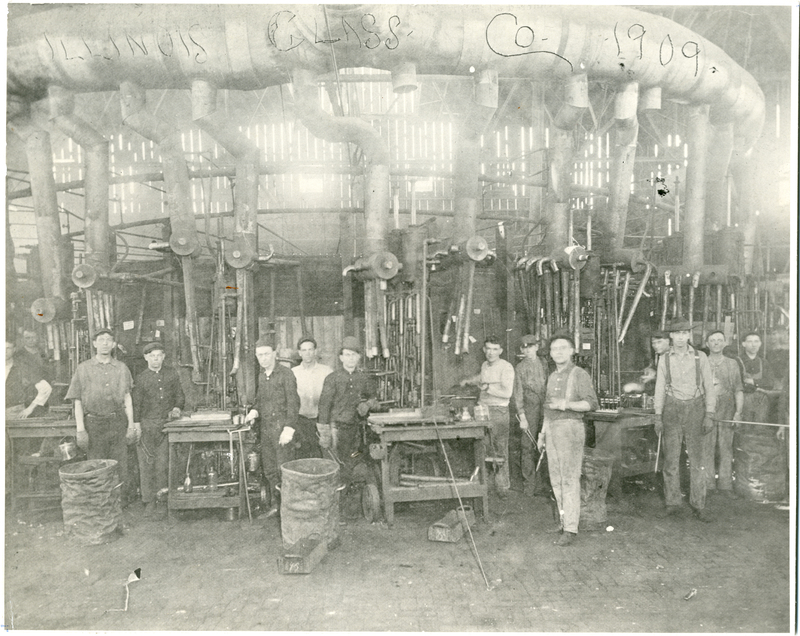
At what (x,y) coordinates should I click in order to perform the action: click on trash can. Please return your answer as a coordinate pair (x, y). The height and width of the screenshot is (636, 800). Looking at the image, I should click on (101, 492), (326, 492), (596, 462), (766, 453).